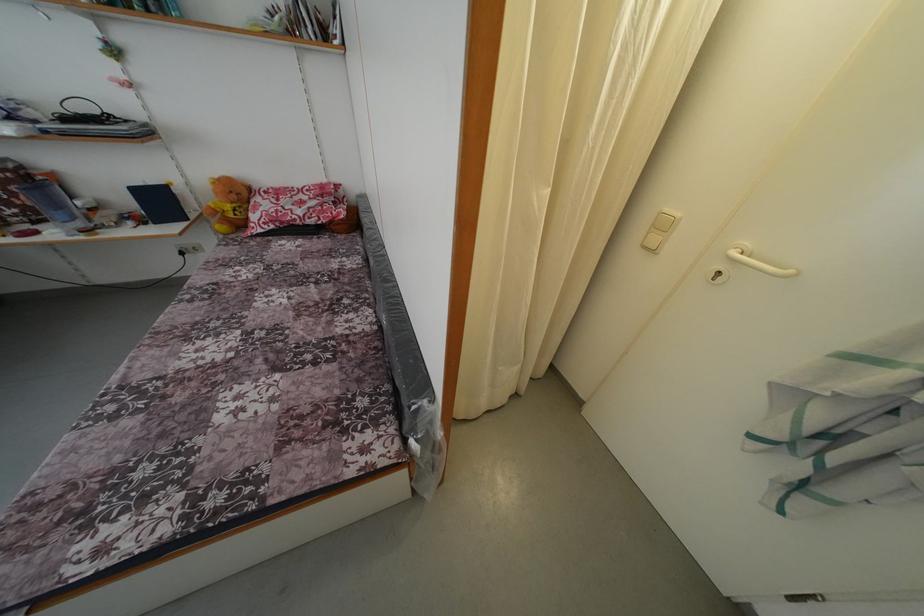
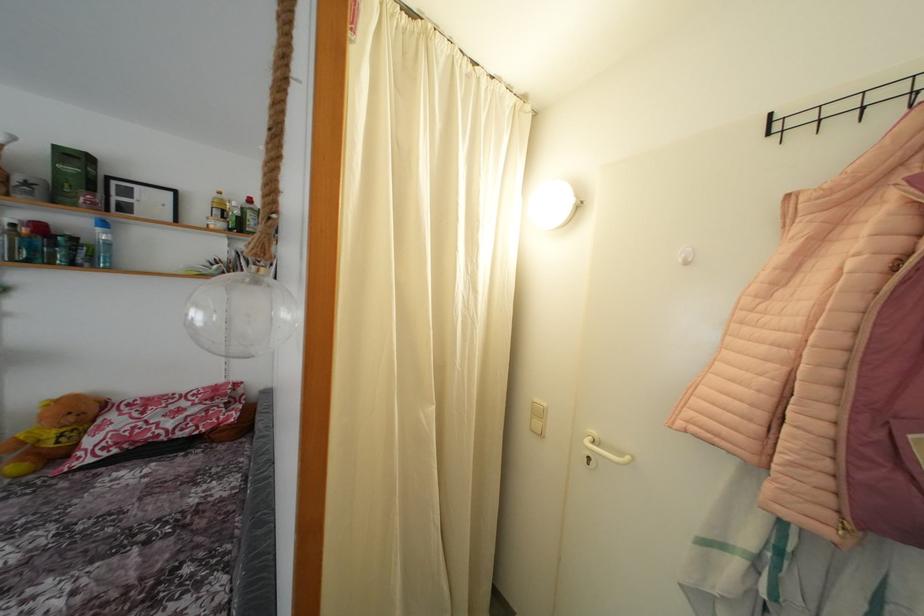
Find the pixel in the second image that matches point (723, 278) in the first image.

(593, 464)